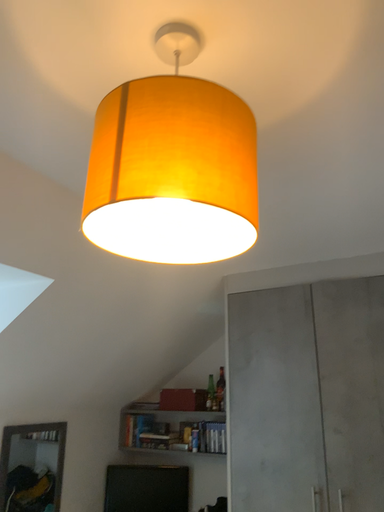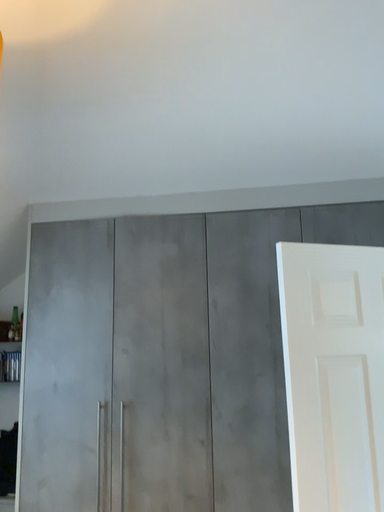
Question: Which way did the camera rotate in the video?

Choices:
 (A) rotated left
 (B) rotated right

Answer: (B)